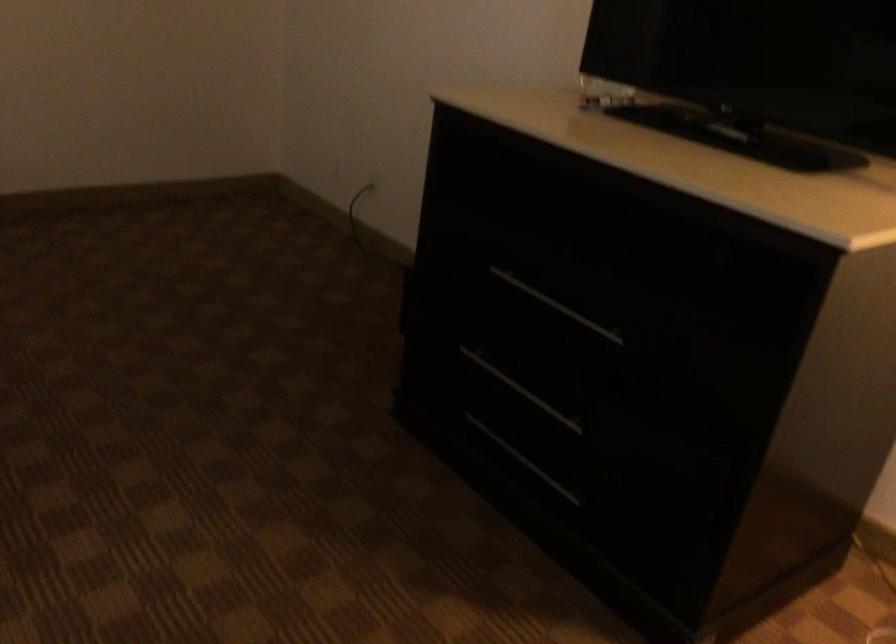
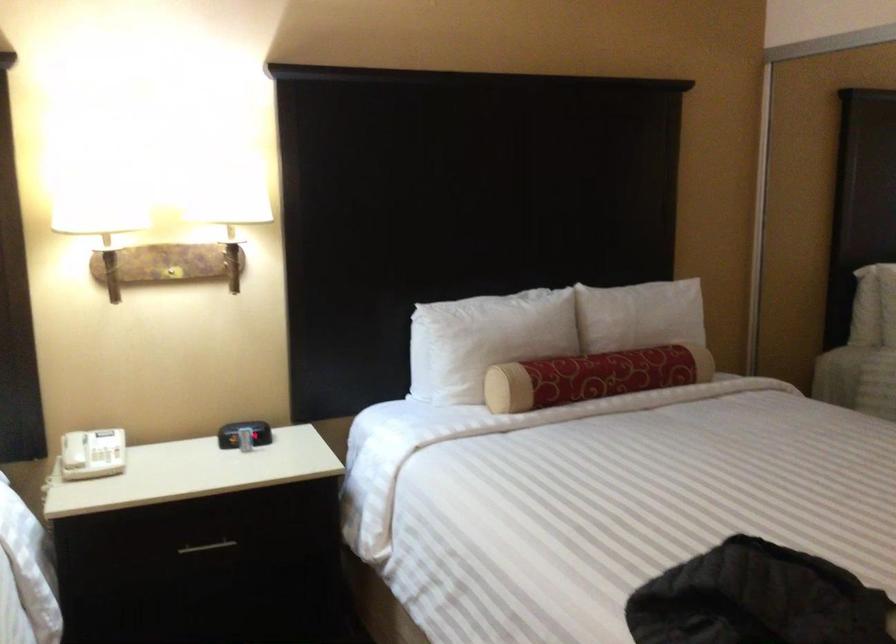
Question: The images are taken continuously from a first-person perspective. In which direction is your viewpoint rotating?

Choices:
 (A) Left
 (B) Right
 (C) Up
 (D) Down

Answer: (A)